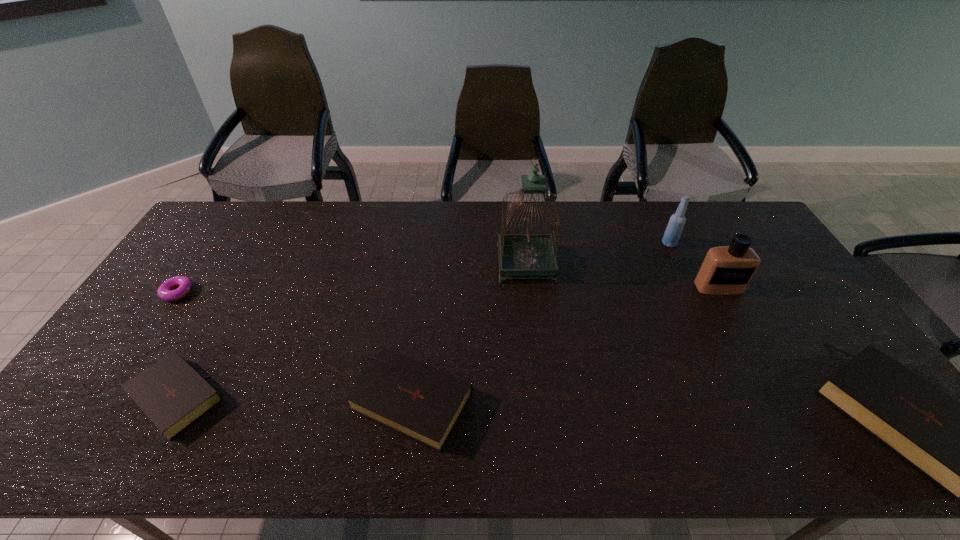
This screenshot has width=960, height=540. I want to click on vacant point located on the right of the shortest Bible, so click(372, 394).

The height and width of the screenshot is (540, 960). I want to click on free space located 0.110m on the left of the third object from left to right, so click(x=307, y=400).

The width and height of the screenshot is (960, 540). What are the coordinates of `free space located on the right of the bottle` in the screenshot? It's located at (708, 244).

Where is `vacant region located 0.140m at the door of the fourth object from right to left`? This screenshot has height=540, width=960. vacant region located 0.140m at the door of the fourth object from right to left is located at coordinates (455, 264).

Locate an element on the screen. The width and height of the screenshot is (960, 540). vacant point located at the door of the fourth object from right to left is located at coordinates (428, 264).

What are the coordinates of `vacant space located at the door of the fourth object from right to left` in the screenshot? It's located at (470, 264).

Find the location of a particular element. The image size is (960, 540). blank space located on the front label of the perfume is located at coordinates (742, 331).

Identify the location of vacant space positioned 0.280m on the back of the shortest object. This screenshot has height=540, width=960. [223, 227].

I want to click on object that is positioned at the far edge, so click(673, 231).

Find the location of a particular element. Image resolution: width=960 pixels, height=540 pixels. Bible that is at the left edge is located at coordinates (173, 395).